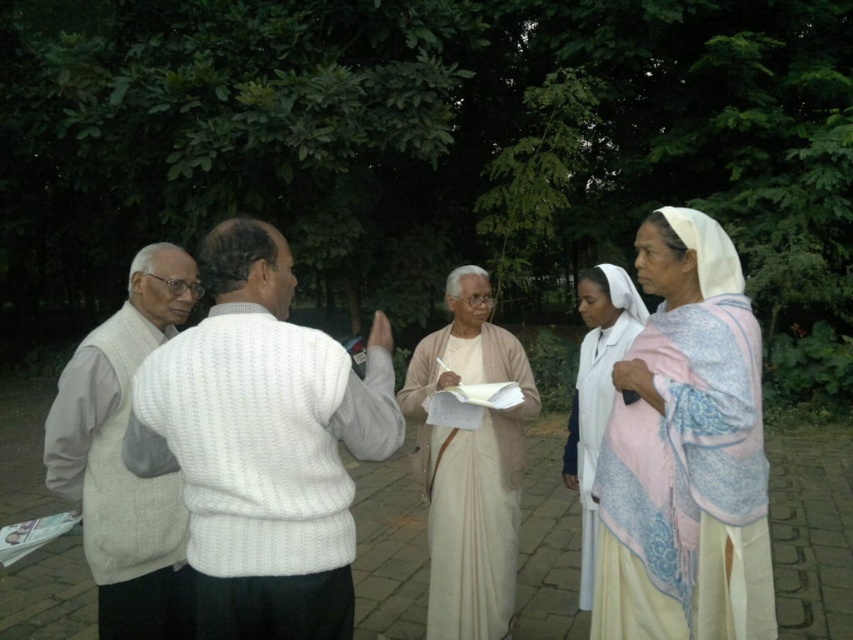
Between white silk saree at right and light beige fabric at center, which one appears on the right side from the viewer's perspective?

white silk saree at right

Is the position of white silk saree at right more distant than that of light beige fabric at center?

No, it is in front of light beige fabric at center.

The image size is (853, 640). Describe the element at coordinates (685, 452) in the screenshot. I see `white silk saree at right` at that location.

Where is `white silk saree at right`? The image size is (853, 640). white silk saree at right is located at coordinates (685, 452).

Does gray knitted sweater vest at left lie behind light beige fabric at center?

No, it is not.

Consider the image. Is gray knitted sweater vest at left thinner than light beige fabric at center?

Correct, gray knitted sweater vest at left's width is less than light beige fabric at center's.

At what (x,y) coordinates should I click in order to perform the action: click on gray knitted sweater vest at left. Please return your answer as a coordinate pair (x, y). Image resolution: width=853 pixels, height=640 pixels. Looking at the image, I should click on (120, 461).

Which is behind, point (117, 616) or point (581, 467)?

Positioned behind is point (581, 467).

What do you see at coordinates (120, 461) in the screenshot? I see `gray knitted sweater vest at left` at bounding box center [120, 461].

Find the location of a particular element. This screenshot has width=853, height=640. gray knitted sweater vest at left is located at coordinates (120, 461).